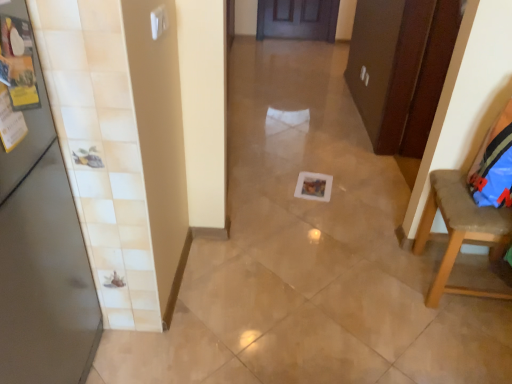
Question: Does point (58, 175) appear closer or farther from the camera than point (466, 241)?

Choices:
 (A) closer
 (B) farther

Answer: (A)

Question: Is metallic gray door at left in front of or behind brown fabric chair at right in the image?

Choices:
 (A) front
 (B) behind

Answer: (A)

Question: Considering the positions of metallic gray door at left and brown fabric chair at right in the image, is metallic gray door at left taller or shorter than brown fabric chair at right?

Choices:
 (A) tall
 (B) short

Answer: (A)

Question: From a real-world perspective, is brown fabric chair at right positioned above or below metallic gray door at left?

Choices:
 (A) below
 (B) above

Answer: (A)

Question: Visually, is brown fabric chair at right positioned to the left or to the right of metallic gray door at left?

Choices:
 (A) right
 (B) left

Answer: (A)

Question: From their relative heights in the image, would you say brown fabric chair at right is taller or shorter than metallic gray door at left?

Choices:
 (A) short
 (B) tall

Answer: (A)

Question: Is brown fabric chair at right wider or thinner than metallic gray door at left?

Choices:
 (A) wide
 (B) thin

Answer: (A)